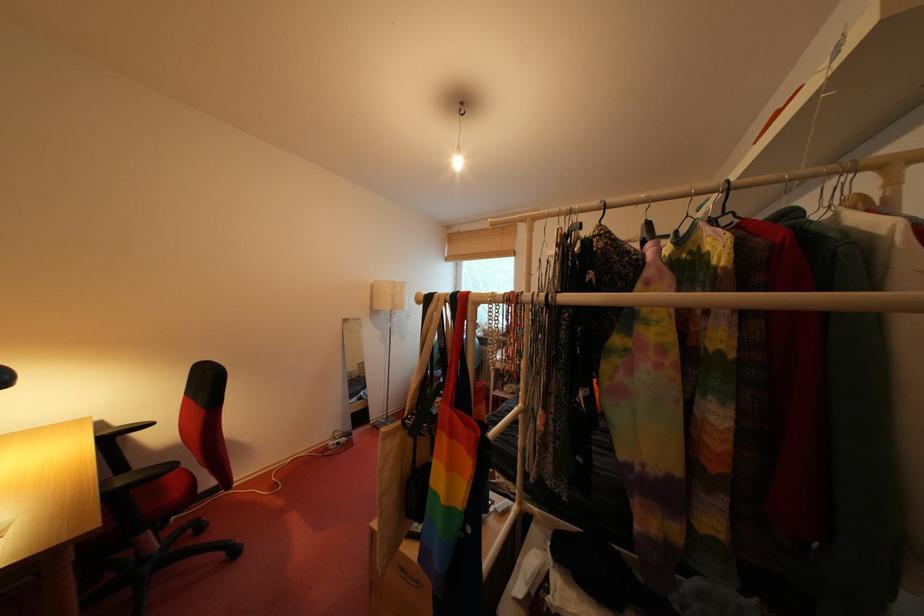
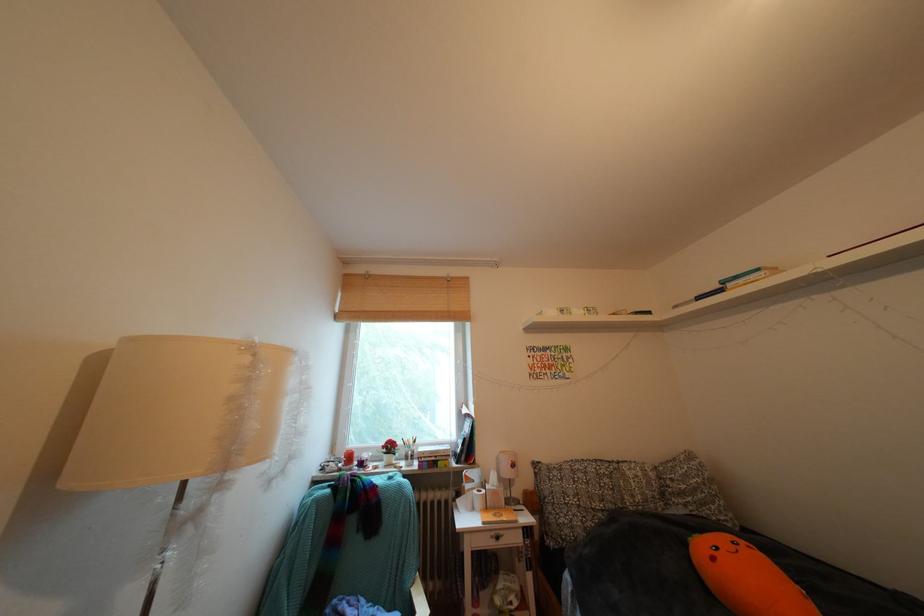
The point at (468, 238) is marked in the first image. Where is the corresponding point in the second image?

(379, 282)